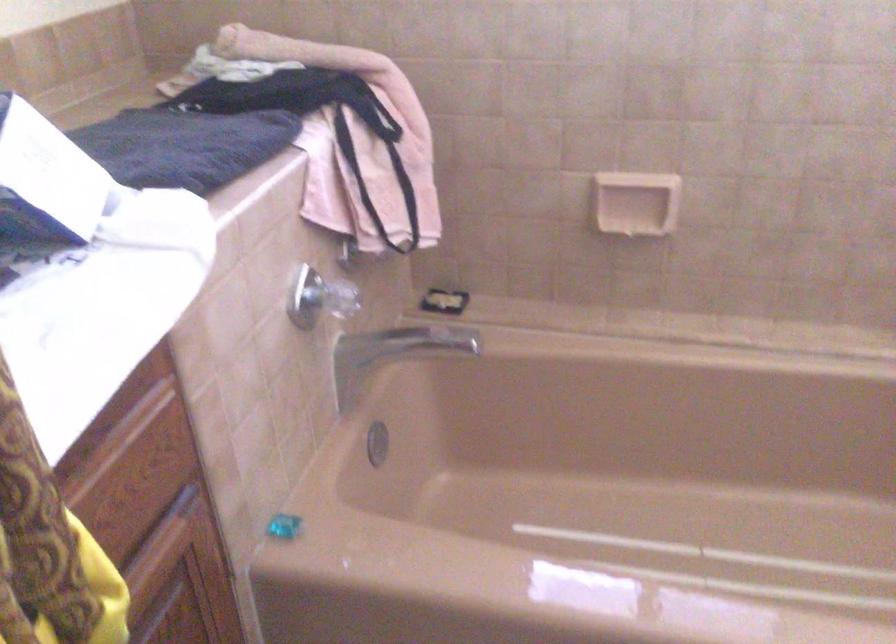
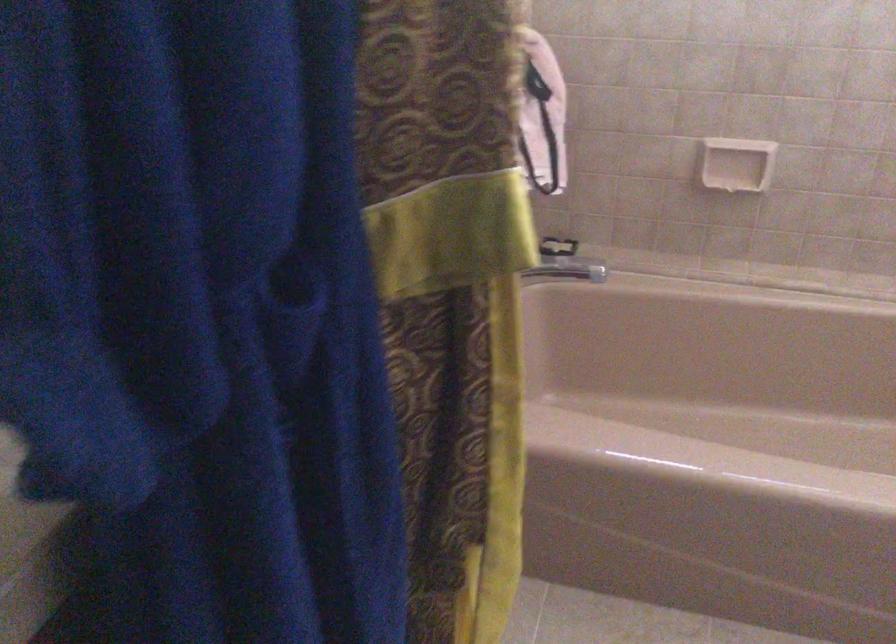
Where in the second image is the point corresponding to pixel 431 346 from the first image?

(569, 269)